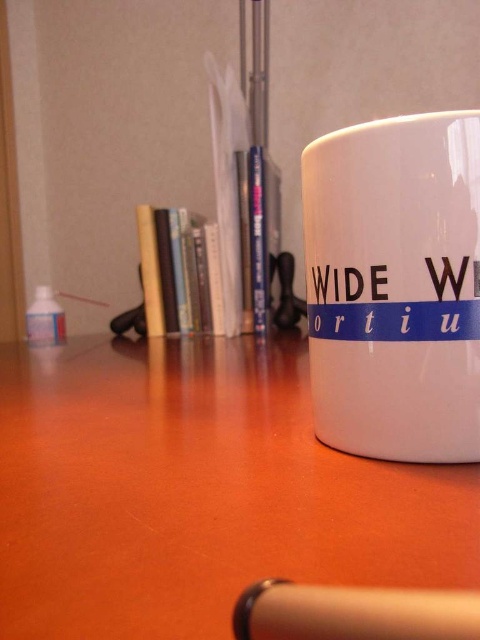
Question: Considering the real-world distances, which object is closest to the metallic silver pen at lower center?

Choices:
 (A) matte wood table at center
 (B) white ceramic mug at right

Answer: (B)

Question: Which of the following is the closest to the observer?

Choices:
 (A) white ceramic mug at right
 (B) metallic silver pen at lower center

Answer: (B)

Question: Can you confirm if matte wood table at center is wider than white ceramic mug at right?

Choices:
 (A) yes
 (B) no

Answer: (A)

Question: Which object is closer to the camera taking this photo?

Choices:
 (A) white ceramic mug at right
 (B) metallic silver pen at lower center
 (C) matte wood table at center

Answer: (B)

Question: Does white ceramic mug at right appear on the right side of metallic silver pen at lower center?

Choices:
 (A) no
 (B) yes

Answer: (B)

Question: Is matte wood table at center wider than metallic silver pen at lower center?

Choices:
 (A) no
 (B) yes

Answer: (B)